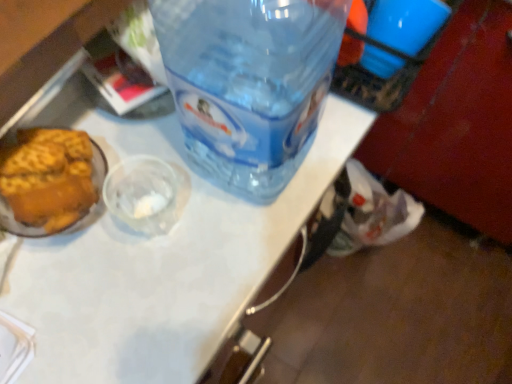
Question: Does transparent plastic bottle at center appear on the right side of transparent plastic table at center?

Choices:
 (A) yes
 (B) no

Answer: (B)

Question: Is transparent plastic bottle at center at the left side of transparent plastic table at center?

Choices:
 (A) no
 (B) yes

Answer: (B)

Question: From a real-world perspective, is transparent plastic bottle at center under transparent plastic table at center?

Choices:
 (A) no
 (B) yes

Answer: (A)

Question: Is transparent plastic bottle at center surrounding transparent plastic table at center?

Choices:
 (A) no
 (B) yes

Answer: (A)

Question: From a real-world perspective, is transparent plastic bottle at center on transparent plastic table at center?

Choices:
 (A) no
 (B) yes

Answer: (B)

Question: Is transparent plastic bottle at center facing away from transparent plastic table at center?

Choices:
 (A) yes
 (B) no

Answer: (B)

Question: Is the position of transparent plastic table at center less distant than that of transparent plastic bottle at center?

Choices:
 (A) yes
 (B) no

Answer: (A)

Question: Is transparent plastic table at center not close to transparent plastic bottle at center?

Choices:
 (A) no
 (B) yes

Answer: (A)

Question: Would you say transparent plastic table at center contains transparent plastic bottle at center?

Choices:
 (A) yes
 (B) no

Answer: (B)

Question: Is transparent plastic table at center taller than transparent plastic bottle at center?

Choices:
 (A) yes
 (B) no

Answer: (A)

Question: Could you tell me if transparent plastic table at center is turned towards transparent plastic bottle at center?

Choices:
 (A) no
 (B) yes

Answer: (A)

Question: Does transparent plastic table at center have a smaller size compared to transparent plastic bottle at center?

Choices:
 (A) yes
 (B) no

Answer: (B)

Question: Based on their sizes in the image, would you say transparent plastic bottle at center is bigger or smaller than transparent plastic table at center?

Choices:
 (A) big
 (B) small

Answer: (B)